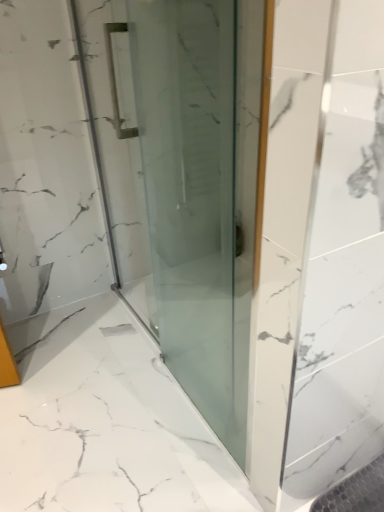
Measure the distance between point (x=50, y=446) and camera.

Answer: Point (x=50, y=446) and camera are 1.36 meters apart.

The height and width of the screenshot is (512, 384). In order to click on transparent glass shower at center in this screenshot , I will do (106, 423).

This screenshot has width=384, height=512. Describe the element at coordinates (106, 423) in the screenshot. I see `transparent glass shower at center` at that location.

Where is `transparent glass door at center`? This screenshot has height=512, width=384. transparent glass door at center is located at coordinates (182, 181).

What do you see at coordinates (182, 181) in the screenshot?
I see `transparent glass door at center` at bounding box center [182, 181].

Image resolution: width=384 pixels, height=512 pixels. In order to click on transparent glass shower at center in this screenshot , I will do `click(106, 423)`.

Does transparent glass door at center appear on the right side of transparent glass shower at center?

No, transparent glass door at center is not to the right of transparent glass shower at center.

Relative to transparent glass shower at center, is transparent glass door at center in front or behind?

In the image, transparent glass door at center appears in front of transparent glass shower at center.

Between point (188, 100) and point (119, 456), which one is positioned in front?

The point (119, 456) is closer to the camera.

From the image's perspective, is transparent glass door at center above transparent glass shower at center?

Yes, from the image's perspective, transparent glass door at center is above transparent glass shower at center.

From a real-world perspective, is transparent glass door at center physically located above or below transparent glass shower at center?

transparent glass door at center is above transparent glass shower at center.

Considering the relative sizes of transparent glass door at center and transparent glass shower at center in the image provided, is transparent glass door at center wider than transparent glass shower at center?

In fact, transparent glass door at center might be narrower than transparent glass shower at center.

Can you confirm if transparent glass door at center is taller than transparent glass shower at center?

Yes.

Considering the relative sizes of transparent glass door at center and transparent glass shower at center in the image provided, is transparent glass door at center bigger than transparent glass shower at center?

No.

Consider the image. Is transparent glass door at center situated inside transparent glass shower at center or outside?

transparent glass door at center exists outside the volume of transparent glass shower at center.

Would you consider transparent glass door at center to be distant from transparent glass shower at center?

transparent glass door at center is actually quite close to transparent glass shower at center.

Looking at this image, is transparent glass door at center looking in the opposite direction of transparent glass shower at center?

Yes, transparent glass door at center's orientation is away from transparent glass shower at center.

How different are the orientations of transparent glass door at center and transparent glass shower at center in degrees?

They differ by 3.24 degrees in their facing directions.

Where is `door on the left of transparent glass shower at center`? Image resolution: width=384 pixels, height=512 pixels. door on the left of transparent glass shower at center is located at coordinates (182, 181).

Can you confirm if transparent glass shower at center is positioned to the left of transparent glass door at center?

No, transparent glass shower at center is not to the left of transparent glass door at center.

Is the position of transparent glass shower at center more distant than that of transparent glass door at center?

That is True.

Considering the points (60, 461) and (200, 361), which point is in front, point (60, 461) or point (200, 361)?

Positioned in front is point (60, 461).

From the image's perspective, between transparent glass shower at center and transparent glass door at center, which one is located above?

transparent glass door at center, from the image's perspective.

From a real-world perspective, is transparent glass shower at center beneath transparent glass door at center?

Yes.

Which object is wider, transparent glass shower at center or transparent glass door at center?

With larger width is transparent glass shower at center.

Between transparent glass shower at center and transparent glass door at center, which one has less height?

transparent glass shower at center.

In terms of size, does transparent glass shower at center appear bigger or smaller than transparent glass door at center?

Clearly, transparent glass shower at center is larger in size than transparent glass door at center.

Would you say transparent glass shower at center is inside or outside transparent glass door at center?

transparent glass shower at center is not enclosed by transparent glass door at center.

Is transparent glass shower at center not near transparent glass door at center?

That's not correct — transparent glass shower at center is a little close to transparent glass door at center.

Is transparent glass shower at center facing away from transparent glass door at center?

No, transparent glass shower at center is not facing away from transparent glass door at center.

What's the angular difference between transparent glass shower at center and transparent glass door at center's facing directions?

The facing directions of transparent glass shower at center and transparent glass door at center are 3.24 degrees apart.

You are a GUI agent. You are given a task and a screenshot of the screen. Output one action in this format:
    pyautogui.click(x=<x>, y=<y>)
    Task: Click on the bath behind the transparent glass door at center
    This screenshot has height=512, width=384.
    Given the screenshot: What is the action you would take?
    pyautogui.click(x=106, y=423)

Where is `bath directly beneath the transparent glass door at center (from a real-world perspective)`? The width and height of the screenshot is (384, 512). bath directly beneath the transparent glass door at center (from a real-world perspective) is located at coordinates (106, 423).

This screenshot has width=384, height=512. Identify the location of bath on the right of transparent glass door at center. (106, 423).